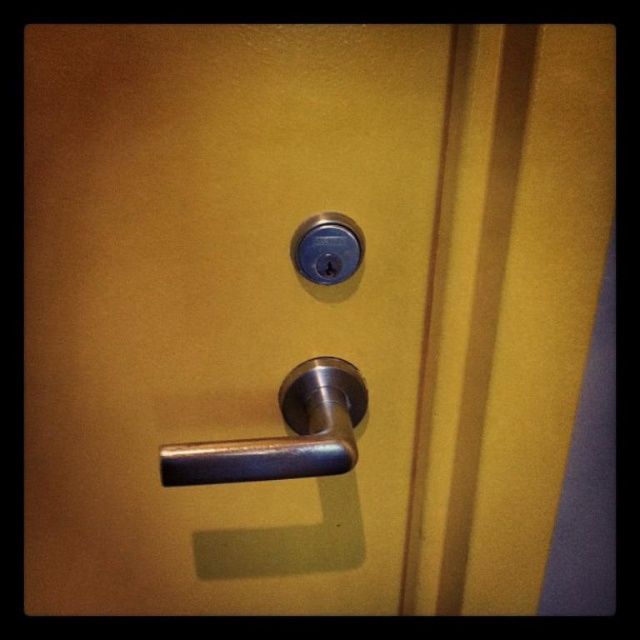
Question: Which of the following is the closest to the observer?

Choices:
 (A) metallic silver handle at center
 (B) polished metal door handle at center
 (C) satin nickel lock at center

Answer: (B)

Question: Does metallic silver handle at center appear over satin nickel lock at center?

Choices:
 (A) no
 (B) yes

Answer: (A)

Question: Which object is the closest to the polished metal door handle at center?

Choices:
 (A) satin nickel lock at center
 (B) metallic silver handle at center

Answer: (A)

Question: Which point appears farthest from the camera in this image?

Choices:
 (A) (355, 252)
 (B) (42, 36)

Answer: (A)

Question: Where is metallic silver handle at center located in relation to satin nickel lock at center in the image?

Choices:
 (A) right
 (B) left

Answer: (B)

Question: Can you confirm if metallic silver handle at center is positioned to the right of satin nickel lock at center?

Choices:
 (A) no
 (B) yes

Answer: (A)